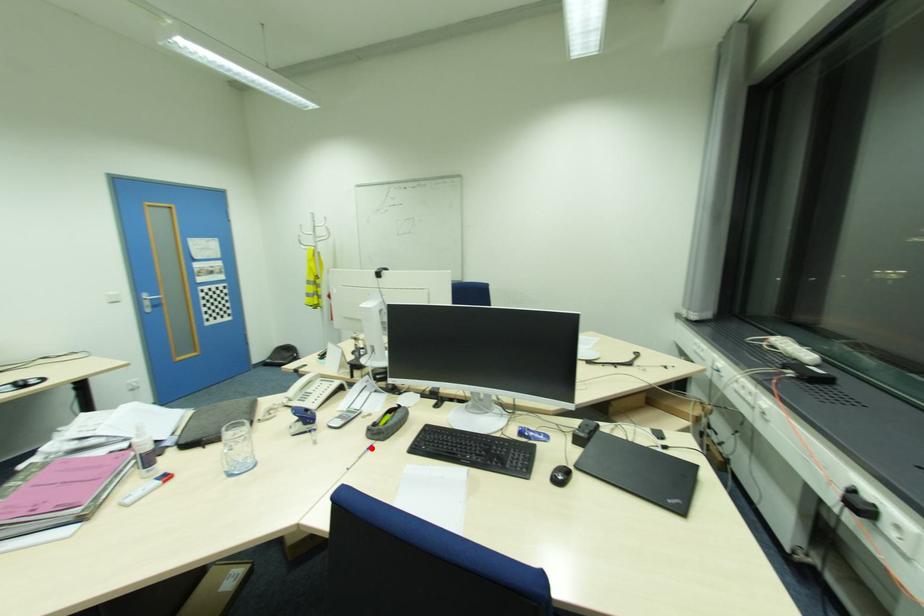
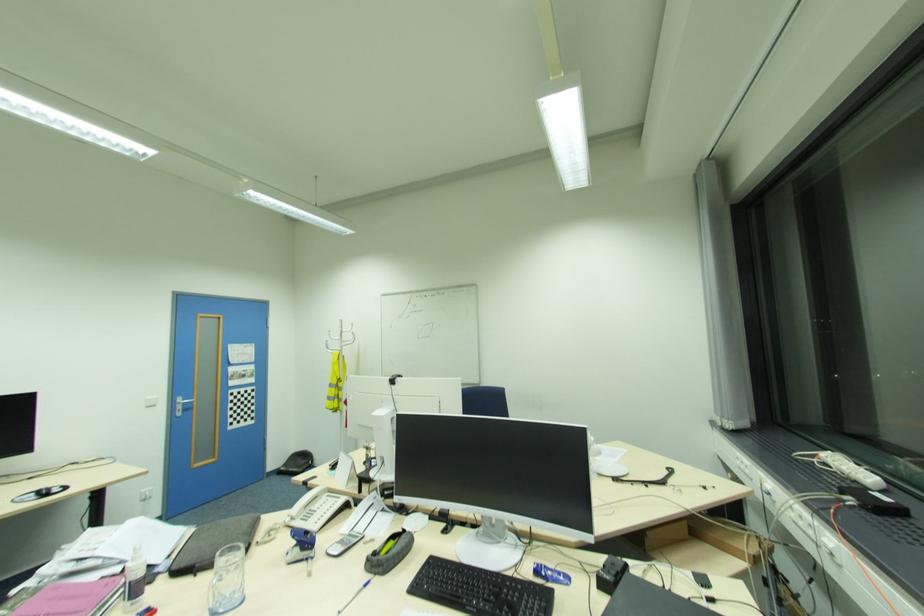
Question: I am providing you with two images of the same scene from different viewpoints. A red point is marked on the first image. Can you still see the location of the red point in image 2?

Choices:
 (A) Yes
 (B) No

Answer: (A)